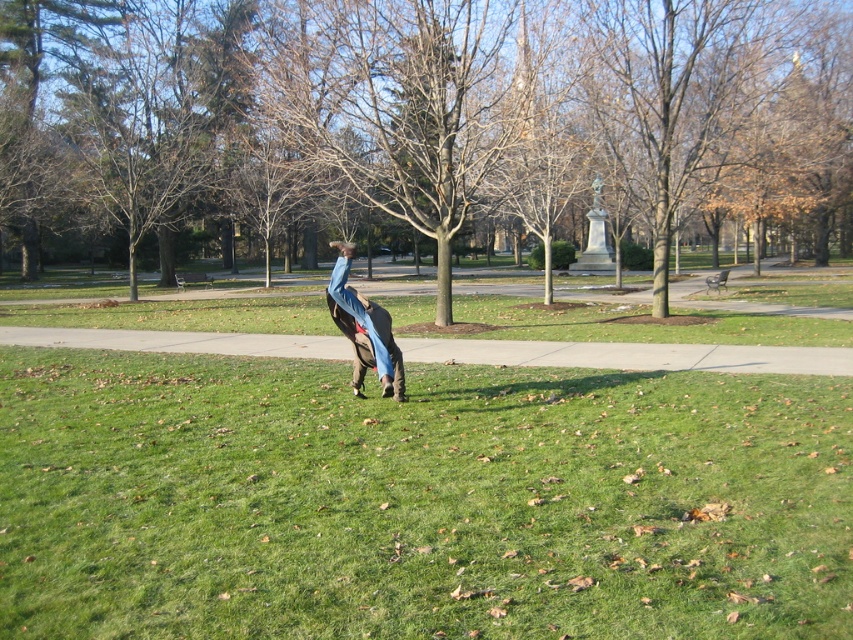
Locate an element on the screen. brown wood tree at center is located at coordinates (462, 120).

Who is shorter, brown wood tree at center or denim pants at center?

Standing shorter between the two is denim pants at center.

Measure the distance between brown wood tree at center and camera.

They are 54.80 feet apart.

Image resolution: width=853 pixels, height=640 pixels. What are the coordinates of `brown wood tree at center` in the screenshot? It's located at (462, 120).

Between green grass at center and denim pants at center, which one has more height?

denim pants at center is taller.

Is point (456, 504) farther from viewer compared to point (387, 369)?

No, (456, 504) is closer to viewer.

This screenshot has width=853, height=640. Find the location of `green grass at center`. green grass at center is located at coordinates (416, 500).

Does green grass at center have a lesser width compared to brown wood tree at center?

Yes.

Which is above, green grass at center or brown wood tree at center?

brown wood tree at center

Who is more distant from viewer, (485,490) or (614,109)?

The point (614,109) is behind.

Where is `green grass at center`? The height and width of the screenshot is (640, 853). green grass at center is located at coordinates (416, 500).